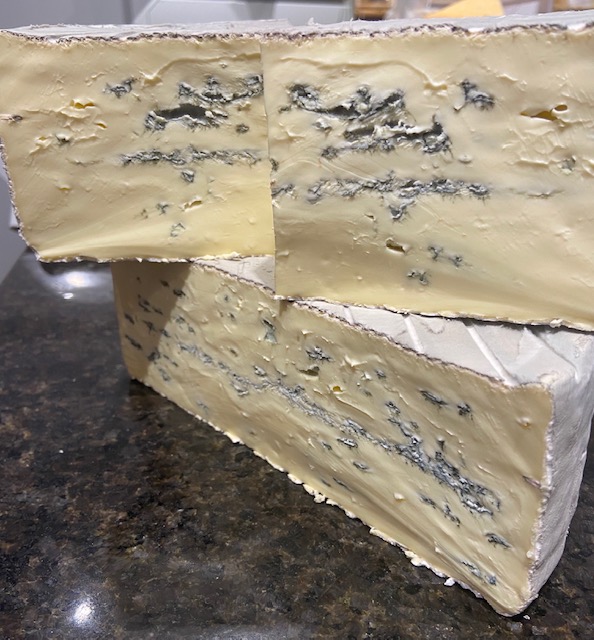
At what (x,y) coordinates should I click in order to perform the action: click on black, brown and gray marble countertop. Please return your answer as a coordinate pair (x, y). Looking at the image, I should click on (91, 454).